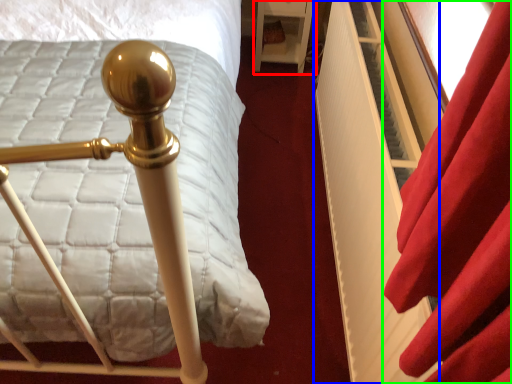
Question: Which is farther away from furniture (highlighted by a red box)? bed frame (highlighted by a blue box) or curtain (highlighted by a green box)?

Choices:
 (A) bed frame
 (B) curtain

Answer: (B)